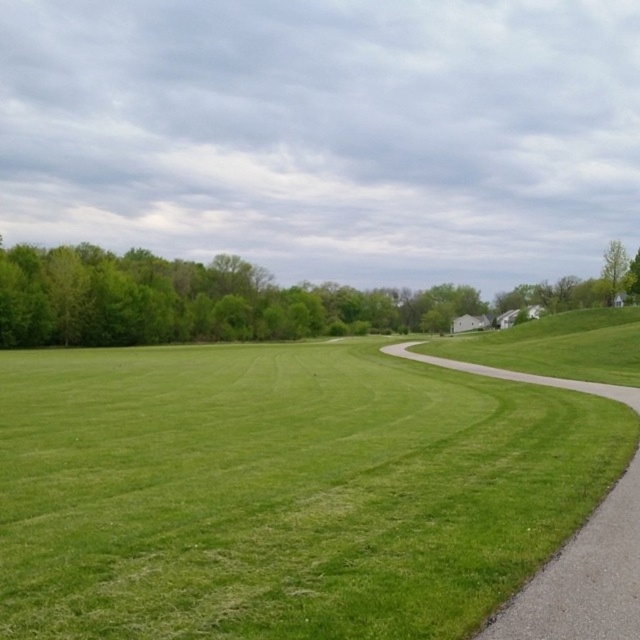
Question: Which of the following is the closest to the observer?

Choices:
 (A) (618, 508)
 (B) (189, 339)

Answer: (A)

Question: Is green leafy tree at left thinner than gravel path at right?

Choices:
 (A) no
 (B) yes

Answer: (A)

Question: Can you confirm if green leafy tree at left is smaller than gravel path at right?

Choices:
 (A) yes
 (B) no

Answer: (B)

Question: Is green leafy tree at left bigger than gravel path at right?

Choices:
 (A) yes
 (B) no

Answer: (A)

Question: Which point is closer to the camera?

Choices:
 (A) pos(451,365)
 (B) pos(198,317)

Answer: (A)